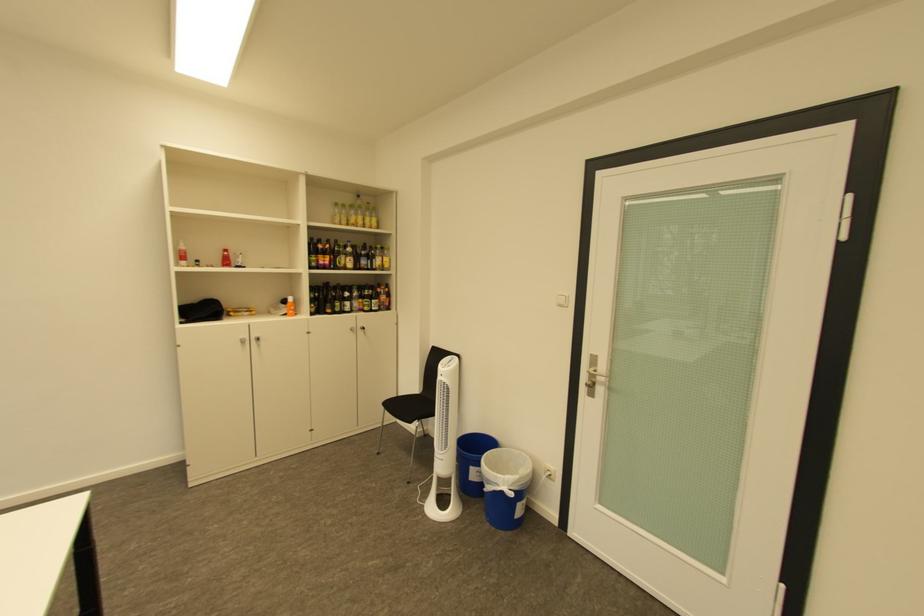
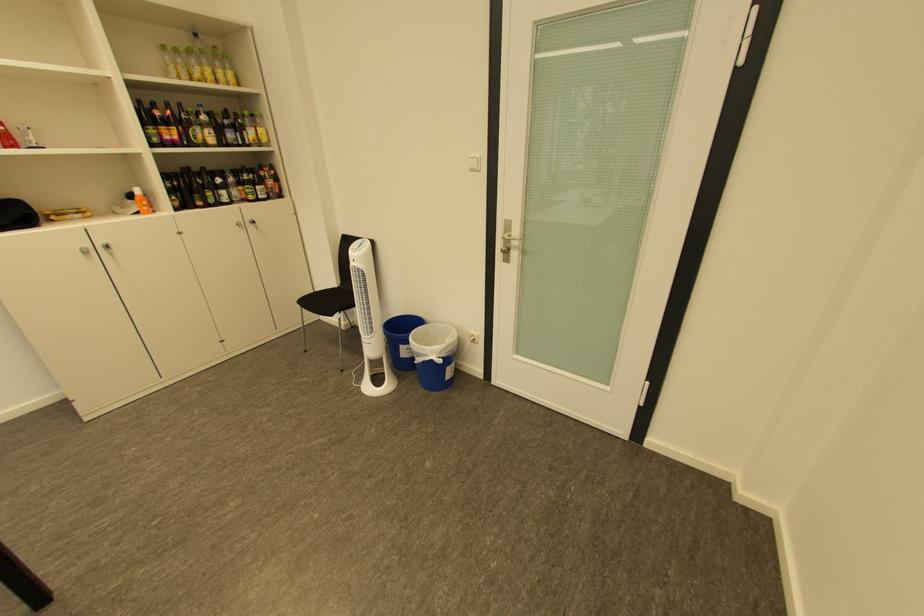
The point at (395, 411) is marked in the first image. Where is the corresponding point in the second image?

(312, 310)